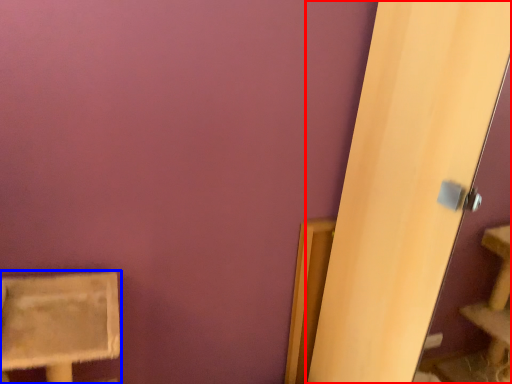
Question: Which point is further to the camera, screen door (highlighted by a red box) or furniture (highlighted by a blue box)?

Choices:
 (A) screen door
 (B) furniture

Answer: (B)